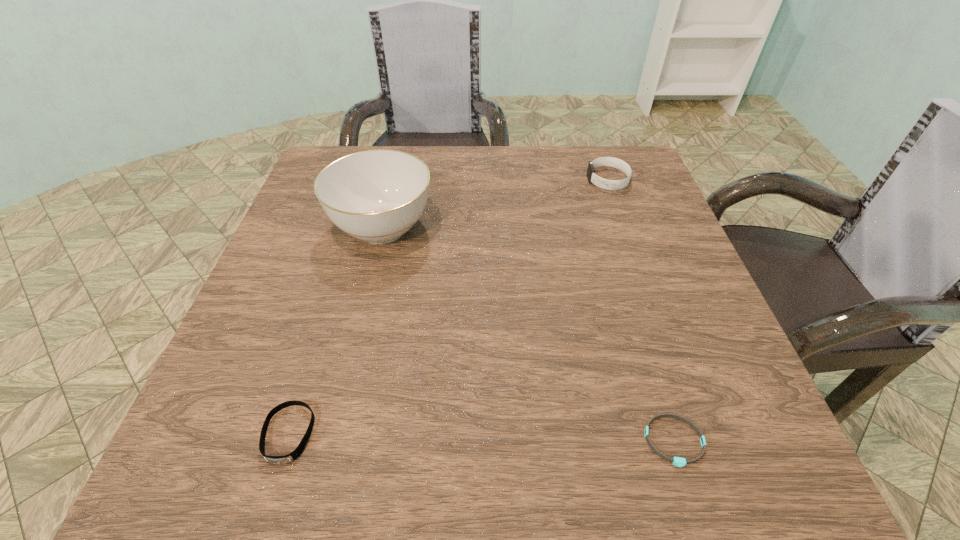
The width and height of the screenshot is (960, 540). Find the location of `free space at the left edge of the desktop`. free space at the left edge of the desktop is located at coordinates (267, 333).

Locate an element on the screen. free space at the right edge of the desktop is located at coordinates (694, 282).

You are a GUI agent. You are given a task and a screenshot of the screen. Output one action in this format:
    pyautogui.click(x=<x>, y=<y>)
    Task: Click on the free spot at the far left corner of the desktop
    
    Given the screenshot: What is the action you would take?
    pyautogui.click(x=343, y=146)

Locate an element on the screen. The width and height of the screenshot is (960, 540). free space at the near left corner of the desktop is located at coordinates (268, 485).

Where is `free space between the chinaware and the shortest object`? Image resolution: width=960 pixels, height=540 pixels. free space between the chinaware and the shortest object is located at coordinates (528, 335).

Locate an element on the screen. The width and height of the screenshot is (960, 540). free space that is in between the tallest object and the shortest object is located at coordinates (528, 335).

This screenshot has height=540, width=960. I want to click on empty location between the second shortest wristband and the farthest wristband, so click(x=448, y=307).

The image size is (960, 540). I want to click on free space between the second shortest object and the tallest wristband, so point(448,307).

Find the location of a particular element. The height and width of the screenshot is (540, 960). vacant space that's between the tallest wristband and the shortest object is located at coordinates (641, 310).

The image size is (960, 540). What are the coordinates of `blank region between the tallest object and the second tallest wristband` in the screenshot? It's located at (336, 331).